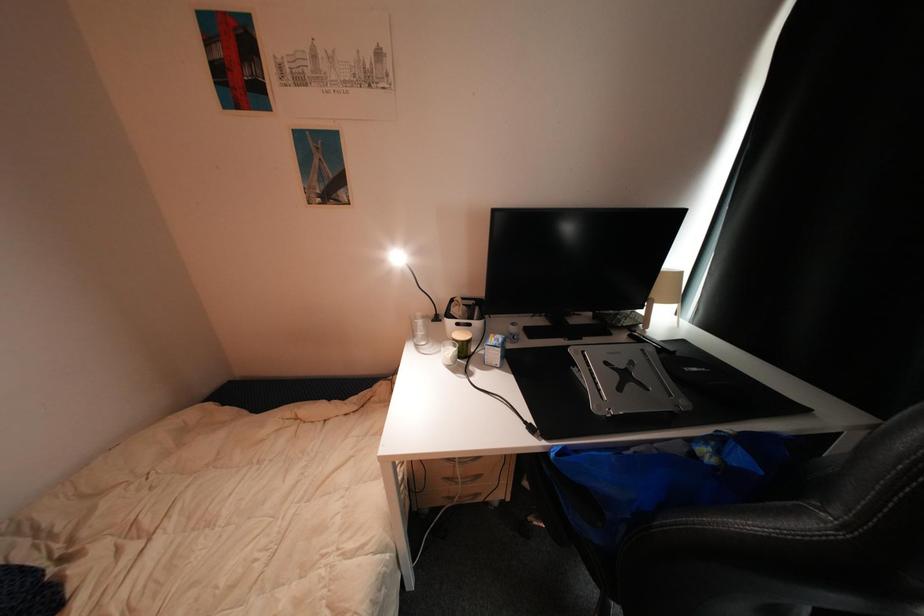
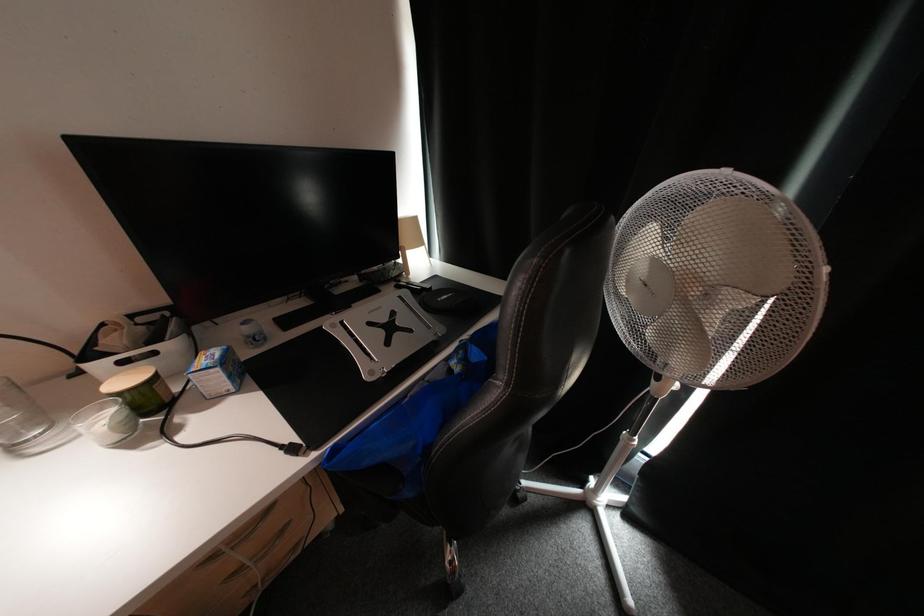
Question: The first image is from the beginning of the video and the second image is from the end. How did the camera likely rotate when shooting the video?

Choices:
 (A) Left
 (B) Right
 (C) Up
 (D) Down

Answer: (B)